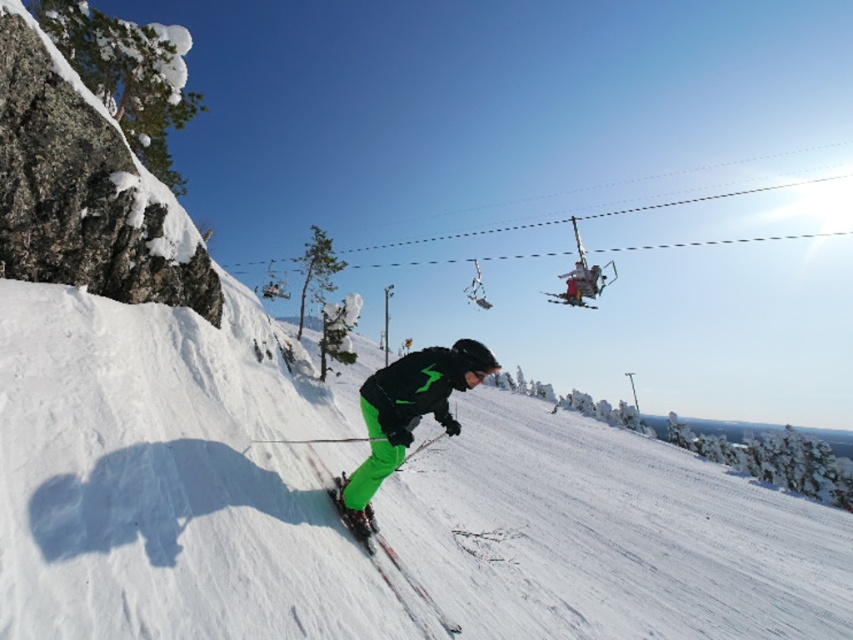
Question: Which object is positioned closest to the green matte ski at center?

Choices:
 (A) green matte snow pants at center
 (B) green matte ski slope at center

Answer: (A)

Question: Which object appears closest to the camera in this image?

Choices:
 (A) green matte snow pants at center
 (B) green matte ski at center
 (C) green matte ski slope at center

Answer: (C)

Question: Considering the relative positions of green matte ski slope at center and green matte ski at center in the image provided, where is green matte ski slope at center located with respect to green matte ski at center?

Choices:
 (A) right
 (B) left

Answer: (A)

Question: Considering the real-world distances, which object is farthest from the green matte snow pants at center?

Choices:
 (A) green matte ski at center
 (B) green matte ski slope at center

Answer: (B)

Question: Considering the relative positions of green matte snow pants at center and green matte ski at center in the image provided, where is green matte snow pants at center located with respect to green matte ski at center?

Choices:
 (A) left
 (B) right

Answer: (B)

Question: Does green matte ski slope at center have a lesser width compared to green matte snow pants at center?

Choices:
 (A) no
 (B) yes

Answer: (A)